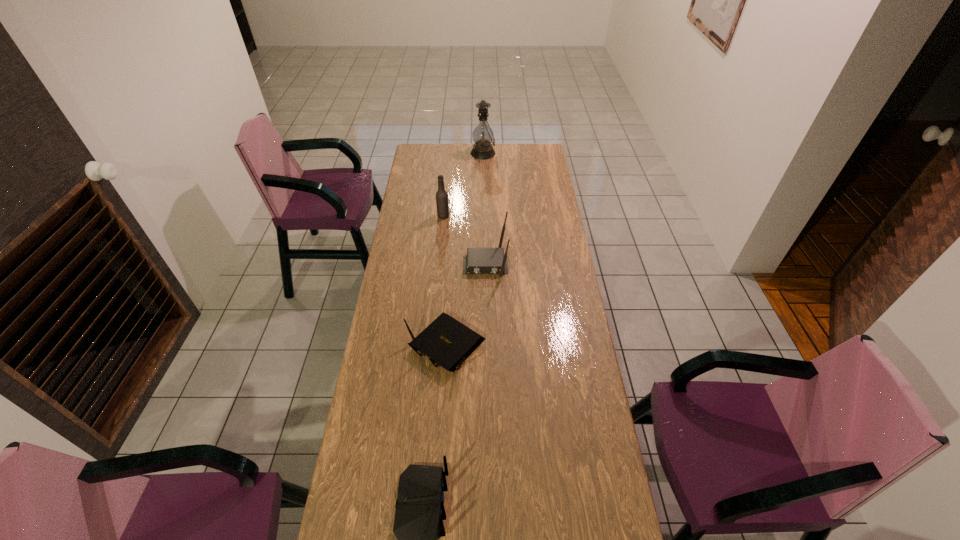
Where is `free space between the oil lamp and the second nearest router`? This screenshot has height=540, width=960. free space between the oil lamp and the second nearest router is located at coordinates (465, 249).

Identify which object is the third closest to the shortest object. Please provide its 2D coordinates. Your answer should be formatted as a tuple, i.e. [(x, y)], where the tuple contains the x and y coordinates of a point satisfying the conditions above.

[(442, 204)]

Select which object appears as the second closest to the shortest object. Please provide its 2D coordinates. Your answer should be formatted as a tuple, i.e. [(x, y)], where the tuple contains the x and y coordinates of a point satisfying the conditions above.

[(418, 522)]

The height and width of the screenshot is (540, 960). I want to click on router that is the nearest to the farthest object, so click(478, 260).

Locate which router is the second closest to the second nearest router. Please provide its 2D coordinates. Your answer should be formatted as a tuple, i.e. [(x, y)], where the tuple contains the x and y coordinates of a point satisfying the conditions above.

[(418, 522)]